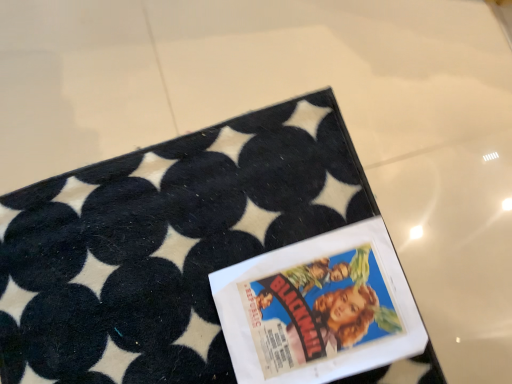
Question: Considering the positions of matte paper comic book at center and black felt rug at upper center in the image, is matte paper comic book at center wider or thinner than black felt rug at upper center?

Choices:
 (A) thin
 (B) wide

Answer: (A)

Question: Is matte paper comic book at center bigger or smaller than black felt rug at upper center?

Choices:
 (A) big
 (B) small

Answer: (B)

Question: From a real-world perspective, is matte paper comic book at center above or below black felt rug at upper center?

Choices:
 (A) below
 (B) above

Answer: (A)

Question: Is black felt rug at upper center taller or shorter than matte paper comic book at center?

Choices:
 (A) tall
 (B) short

Answer: (B)

Question: Would you say black felt rug at upper center is to the left or to the right of matte paper comic book at center in the picture?

Choices:
 (A) left
 (B) right

Answer: (A)

Question: Choose the correct answer: Is black felt rug at upper center inside matte paper comic book at center or outside it?

Choices:
 (A) inside
 (B) outside

Answer: (B)

Question: Considering the positions of black felt rug at upper center and matte paper comic book at center in the image, is black felt rug at upper center bigger or smaller than matte paper comic book at center?

Choices:
 (A) big
 (B) small

Answer: (A)